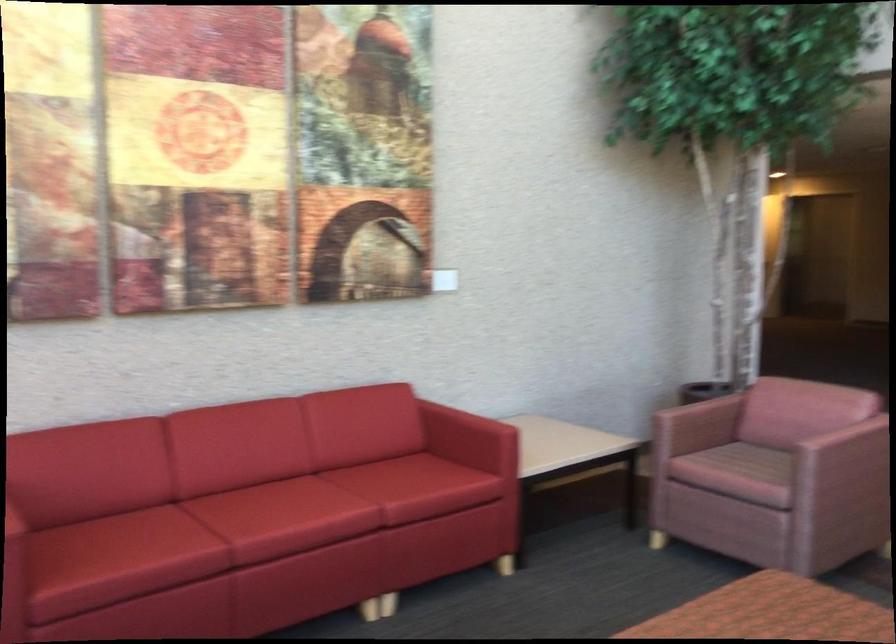
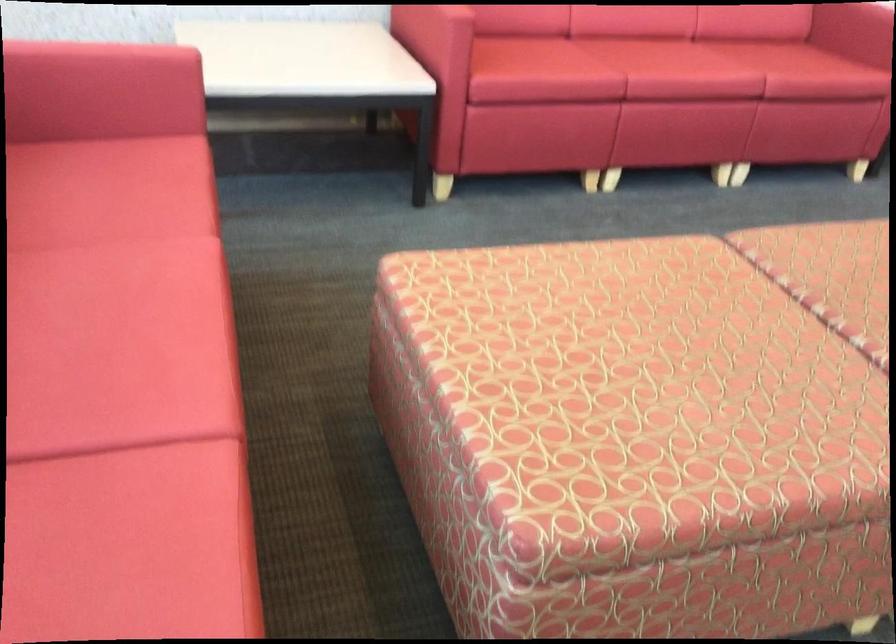
In the second image, find the point that corresponds to (x=290, y=511) in the first image.

(677, 62)